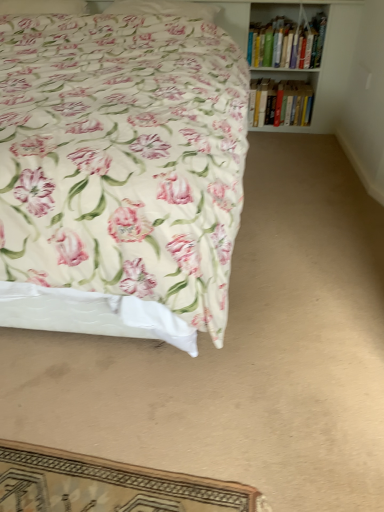
How much space does floral fabric pillow at upper left, the second pillow in the right-to-left sequence, occupy vertically?

It is 4.00 inches.

Find the location of `hardcover books at upper right, arranged as the first book when ordered from the bottom`. hardcover books at upper right, arranged as the first book when ordered from the bottom is located at coordinates (280, 103).

Considering the sizes of hardcover books at upper right, which appears as the second book when ordered from the bottom, and floral fabric pillow at upper center, the 2th pillow from the left, in the image, is hardcover books at upper right, which appears as the second book when ordered from the bottom, wider or thinner than floral fabric pillow at upper center, the 2th pillow from the left,?

Considering their sizes, hardcover books at upper right, which appears as the second book when ordered from the bottom, looks broader than floral fabric pillow at upper center, the 2th pillow from the left.

Can you confirm if hardcover books at upper right, which appears as the second book when ordered from the bottom, is positioned to the right of floral fabric pillow at upper center, the first pillow viewed from the right?

Yes, hardcover books at upper right, which appears as the second book when ordered from the bottom, is to the right of floral fabric pillow at upper center, the first pillow viewed from the right.

From a real-world perspective, relative to floral fabric pillow at upper center, the first pillow viewed from the right, is hardcover books at upper right, acting as the 1th book starting from the top, vertically above or below?

hardcover books at upper right, acting as the 1th book starting from the top, is situated lower than floral fabric pillow at upper center, the first pillow viewed from the right, in the real world.

Does hardcover books at upper right, acting as the 1th book starting from the top, turn towards floral fabric pillow at upper center, the 2th pillow from the left?

No, hardcover books at upper right, acting as the 1th book starting from the top, is not turned towards floral fabric pillow at upper center, the 2th pillow from the left.

From the image's perspective, between hardcover books at upper right, arranged as the first book when ordered from the bottom, and hardcover books at upper right, acting as the 1th book starting from the top, which one is located above?

hardcover books at upper right, acting as the 1th book starting from the top, appears higher in the image.

From a real-world perspective, is hardcover books at upper right, the 2th book viewed from the top, above or below hardcover books at upper right, which appears as the second book when ordered from the bottom?

Clearly, from a real-world perspective, hardcover books at upper right, the 2th book viewed from the top, is below hardcover books at upper right, which appears as the second book when ordered from the bottom.

In the image, is hardcover books at upper right, arranged as the first book when ordered from the bottom, positioned in front of or behind hardcover books at upper right, which appears as the second book when ordered from the bottom?

hardcover books at upper right, arranged as the first book when ordered from the bottom, is positioned farther from the viewer than hardcover books at upper right, which appears as the second book when ordered from the bottom.

Is hardcover books at upper right, arranged as the first book when ordered from the bottom, aimed at hardcover books at upper right, which appears as the second book when ordered from the bottom?

No, hardcover books at upper right, arranged as the first book when ordered from the bottom, is not aimed at hardcover books at upper right, which appears as the second book when ordered from the bottom.

Between floral fabric bed at upper left and hardcover books at upper right, arranged as the first book when ordered from the bottom, which one has less height?

With less height is hardcover books at upper right, arranged as the first book when ordered from the bottom.

Between floral fabric bed at upper left and hardcover books at upper right, arranged as the first book when ordered from the bottom, which one appears on the right side from the viewer's perspective?

Positioned to the right is hardcover books at upper right, arranged as the first book when ordered from the bottom.

Is floral fabric bed at upper left turned away from hardcover books at upper right, the 2th book viewed from the top?

No, floral fabric bed at upper left is not facing away from hardcover books at upper right, the 2th book viewed from the top.

Based on the photo, measure the distance from floral fabric bed at upper left to hardcover books at upper right, arranged as the first book when ordered from the bottom.

4.46 feet.

From a real-world perspective, is floral fabric bed at upper left beneath floral fabric pillow at upper left, the second pillow in the right-to-left sequence?

Yes, from a real-world perspective, floral fabric bed at upper left is under floral fabric pillow at upper left, the second pillow in the right-to-left sequence.

Identify the location of pillow lying on the left of floral fabric bed at upper left. (42, 7).

Are floral fabric bed at upper left and floral fabric pillow at upper left, arranged as the 1th pillow when viewed from the left, making contact?

No, floral fabric bed at upper left is not with floral fabric pillow at upper left, arranged as the 1th pillow when viewed from the left.

From the image's perspective, is floral fabric bed at upper left above floral fabric pillow at upper left, arranged as the 1th pillow when viewed from the left?

No.

From a real-world perspective, which object rests below the other?

From a 3D spatial view, hardcover books at upper right, which appears as the second book when ordered from the bottom, is below.

Is point (81, 0) in front of point (267, 42)?

Yes.

From the image's perspective, is floral fabric pillow at upper left, the second pillow in the right-to-left sequence, above hardcover books at upper right, acting as the 1th book starting from the top?

Yes, from the image's perspective, floral fabric pillow at upper left, the second pillow in the right-to-left sequence, is on top of hardcover books at upper right, acting as the 1th book starting from the top.

Could you measure the distance between floral fabric pillow at upper left, arranged as the 1th pillow when viewed from the left, and hardcover books at upper right, acting as the 1th book starting from the top?

1.22 meters.

Is floral fabric pillow at upper center, the 2th pillow from the left, wider than hardcover books at upper right, acting as the 1th book starting from the top?

Incorrect, the width of floral fabric pillow at upper center, the 2th pillow from the left, does not surpass that of hardcover books at upper right, acting as the 1th book starting from the top.

From a real-world perspective, starting from the hardcover books at upper right, acting as the 1th book starting from the top, which pillow is the 1st one vertically above it? Please provide its 2D coordinates.

[(164, 8)]

From their relative heights in the image, would you say floral fabric pillow at upper center, the 2th pillow from the left, is taller or shorter than hardcover books at upper right, acting as the 1th book starting from the top?

Considering their sizes, floral fabric pillow at upper center, the 2th pillow from the left, has less height than hardcover books at upper right, acting as the 1th book starting from the top.

Is floral fabric pillow at upper center, the 2th pillow from the left, in front of hardcover books at upper right, which appears as the second book when ordered from the bottom?

Yes, floral fabric pillow at upper center, the 2th pillow from the left, is closer to the viewer.

Can you confirm if floral fabric bed at upper left is bigger than hardcover books at upper right, which appears as the second book when ordered from the bottom?

Yes.

Is floral fabric bed at upper left next to hardcover books at upper right, which appears as the second book when ordered from the bottom, and touching it?

There is a gap between floral fabric bed at upper left and hardcover books at upper right, which appears as the second book when ordered from the bottom.

Can you tell me how much floral fabric bed at upper left and hardcover books at upper right, which appears as the second book when ordered from the bottom, differ in facing direction?

The facing directions of floral fabric bed at upper left and hardcover books at upper right, which appears as the second book when ordered from the bottom, are 0.189 degrees apart.

The height and width of the screenshot is (512, 384). Find the location of `the 1st book behind the floral fabric pillow at upper center, the 2th pillow from the left`. the 1st book behind the floral fabric pillow at upper center, the 2th pillow from the left is located at coordinates (287, 42).

Where is `book on the left side of hardcover books at upper right, which appears as the second book when ordered from the bottom`? The image size is (384, 512). book on the left side of hardcover books at upper right, which appears as the second book when ordered from the bottom is located at coordinates (280, 103).

Which object lies further to the anchor point floral fabric pillow at upper center, the 2th pillow from the left, floral fabric bed at upper left or floral fabric pillow at upper left, the second pillow in the right-to-left sequence?

Based on the image, floral fabric bed at upper left appears to be further to floral fabric pillow at upper center, the 2th pillow from the left.

When comparing their distances from hardcover books at upper right, acting as the 1th book starting from the top, does floral fabric pillow at upper center, the 2th pillow from the left, or hardcover books at upper right, the 2th book viewed from the top, seem further?

floral fabric pillow at upper center, the 2th pillow from the left, is further to hardcover books at upper right, acting as the 1th book starting from the top.

Which object lies further to the anchor point floral fabric pillow at upper center, the 2th pillow from the left, floral fabric bed at upper left or hardcover books at upper right, which appears as the second book when ordered from the bottom?

Based on the image, floral fabric bed at upper left appears to be further to floral fabric pillow at upper center, the 2th pillow from the left.

When comparing their distances from floral fabric bed at upper left, does floral fabric pillow at upper center, the first pillow viewed from the right, or floral fabric pillow at upper left, the second pillow in the right-to-left sequence, seem closer?

Based on the image, floral fabric pillow at upper center, the first pillow viewed from the right, appears to be nearer to floral fabric bed at upper left.

When comparing their distances from hardcover books at upper right, acting as the 1th book starting from the top, does hardcover books at upper right, the 2th book viewed from the top, or floral fabric pillow at upper center, the 2th pillow from the left, seem further?

Among the two, floral fabric pillow at upper center, the 2th pillow from the left, is located further to hardcover books at upper right, acting as the 1th book starting from the top.

Which object lies nearer to the anchor point floral fabric pillow at upper center, the 2th pillow from the left, hardcover books at upper right, arranged as the first book when ordered from the bottom, or floral fabric pillow at upper left, the second pillow in the right-to-left sequence?

The object closer to floral fabric pillow at upper center, the 2th pillow from the left, is floral fabric pillow at upper left, the second pillow in the right-to-left sequence.

Based on their spatial positions, is hardcover books at upper right, acting as the 1th book starting from the top, or floral fabric pillow at upper center, the first pillow viewed from the right, closer to hardcover books at upper right, the 2th book viewed from the top?

hardcover books at upper right, acting as the 1th book starting from the top, is closer to hardcover books at upper right, the 2th book viewed from the top.

Which object lies nearer to the anchor point hardcover books at upper right, acting as the 1th book starting from the top, floral fabric pillow at upper left, arranged as the 1th pillow when viewed from the left, or floral fabric bed at upper left?

floral fabric bed at upper left is closer to hardcover books at upper right, acting as the 1th book starting from the top.

Locate an element on the screen. Image resolution: width=384 pixels, height=512 pixels. pillow between floral fabric pillow at upper left, arranged as the 1th pillow when viewed from the left, and hardcover books at upper right, which appears as the second book when ordered from the bottom is located at coordinates (164, 8).

Find the location of a particular element. The image size is (384, 512). pillow situated between floral fabric pillow at upper left, the second pillow in the right-to-left sequence, and hardcover books at upper right, the 2th book viewed from the top, from left to right is located at coordinates (164, 8).

At what (x,y) coordinates should I click in order to perform the action: click on book between floral fabric pillow at upper center, the 2th pillow from the left, and hardcover books at upper right, which appears as the second book when ordered from the bottom, in the horizontal direction. Please return your answer as a coordinate pair (x, y). The width and height of the screenshot is (384, 512). Looking at the image, I should click on (280, 103).

Where is `pillow between floral fabric bed at upper left and floral fabric pillow at upper center, the first pillow viewed from the right, from front to back`? The width and height of the screenshot is (384, 512). pillow between floral fabric bed at upper left and floral fabric pillow at upper center, the first pillow viewed from the right, from front to back is located at coordinates (42, 7).